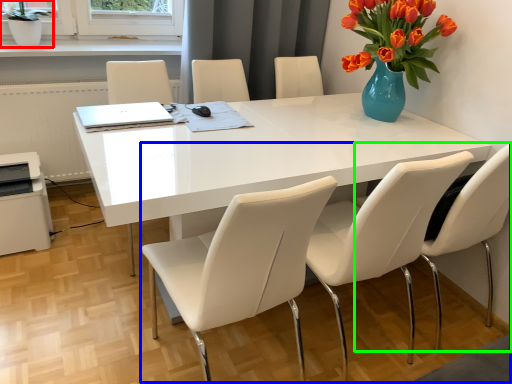
Question: Considering the real-world distances, which object is closest to houseplant (highlighted by a red box)? trio (highlighted by a blue box) or chair (highlighted by a green box).

Choices:
 (A) trio
 (B) chair

Answer: (A)